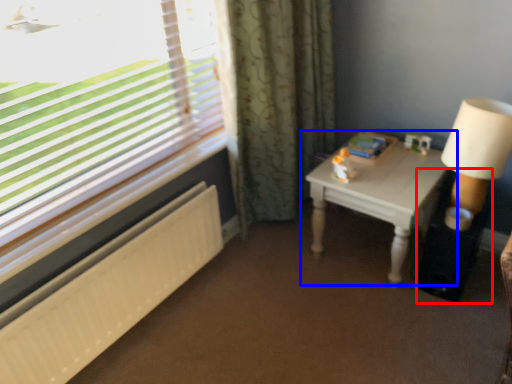
Question: Which of the following is the closest to the observer, side table (highlighted by a red box) or table (highlighted by a blue box)?

Choices:
 (A) side table
 (B) table

Answer: (B)